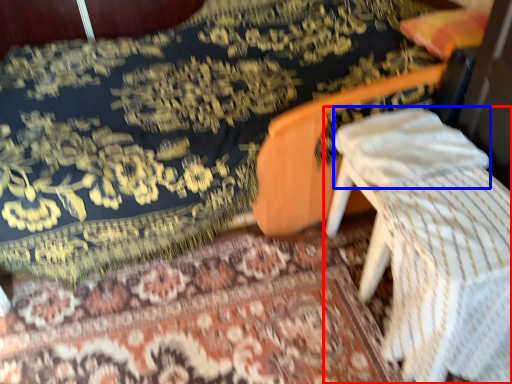
Question: Which of the following is the farthest to the observer, furniture (highlighted by a red box) or pillow (highlighted by a blue box)?

Choices:
 (A) furniture
 (B) pillow

Answer: (B)